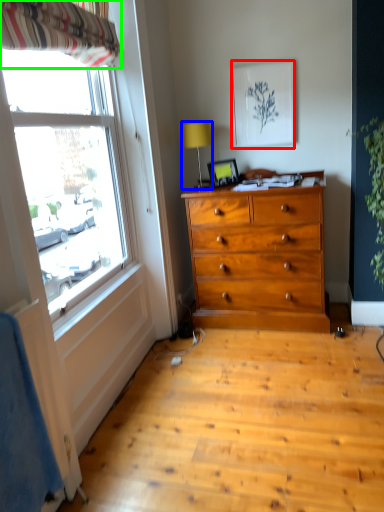
Question: Which object is positioned farthest from picture frame (highlighted by a red box)? Select from lamp (highlighted by a blue box) and curtain (highlighted by a green box).

Choices:
 (A) lamp
 (B) curtain

Answer: (B)